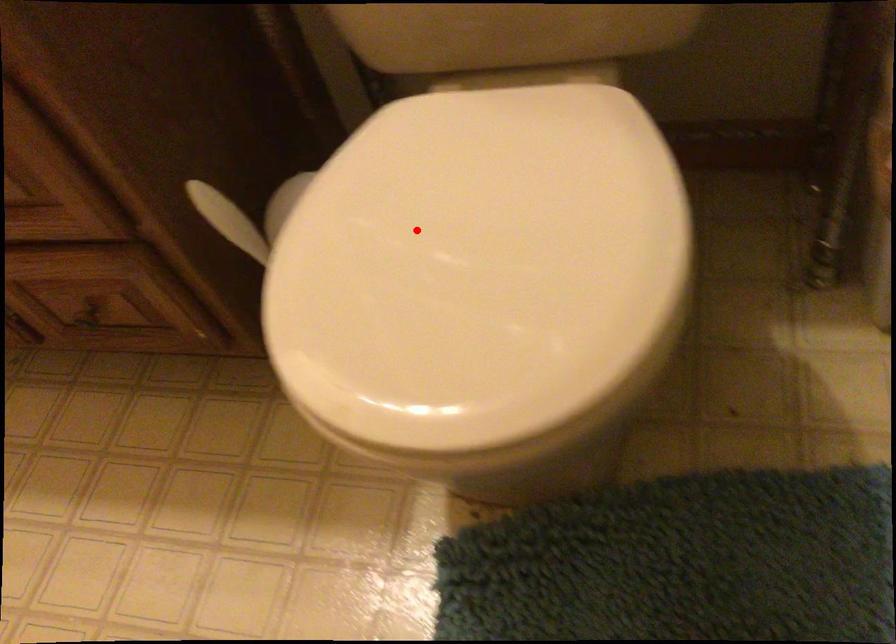
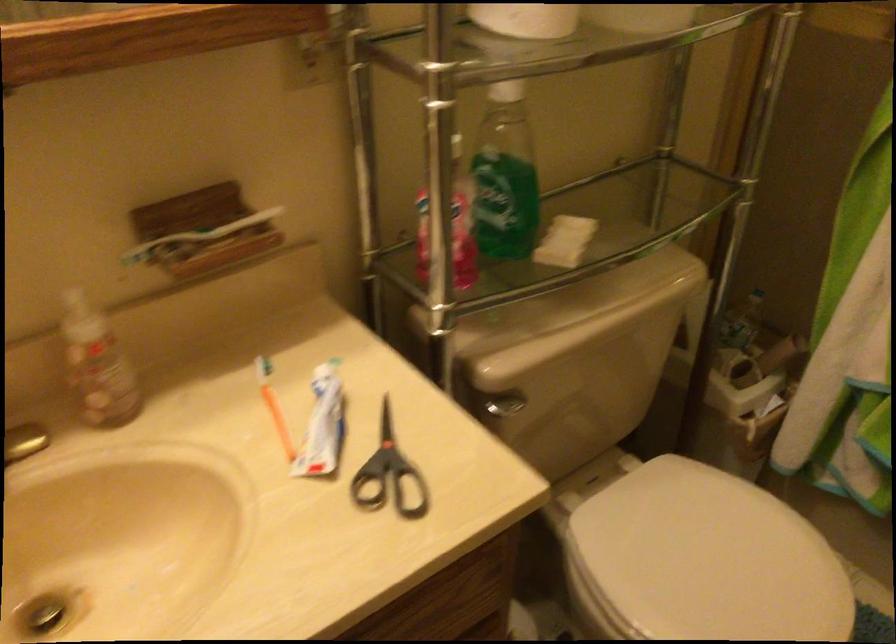
Question: I am providing you with two images of the same scene from different viewpoints. Given a red point in image1, look at the same physical point in image2. Is it:

Choices:
 (A) Closer to the viewpoint
 (B) Farther from the viewpoint

Answer: (B)